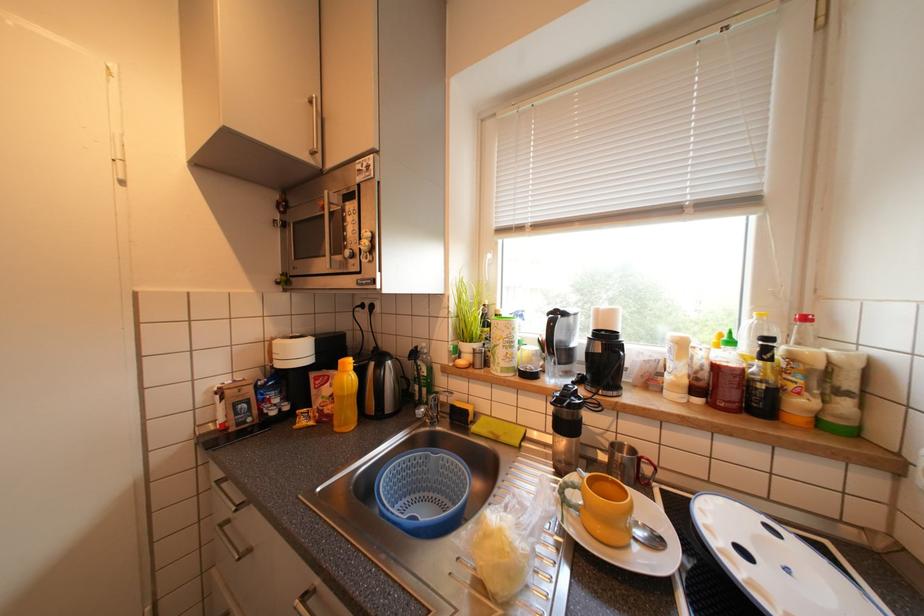
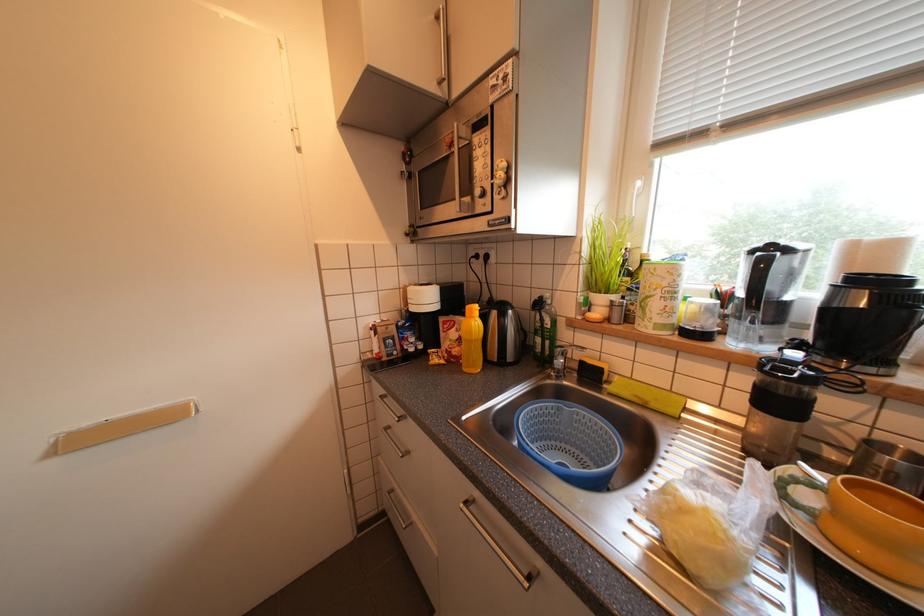
Question: The images are taken continuously from a first-person perspective. In which direction are you moving?

Choices:
 (A) Left
 (B) Right
 (C) Forward
 (D) Backward

Answer: (A)